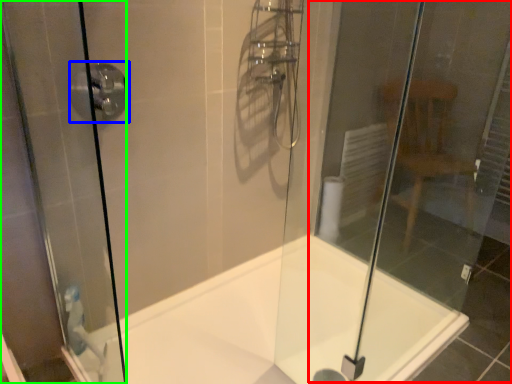
Question: Estimate the real-world distances between objects in this image. Which object is closer to glass door (highlighted by a red box), shower (highlighted by a blue box) or screen door (highlighted by a green box)?

Choices:
 (A) shower
 (B) screen door

Answer: (B)